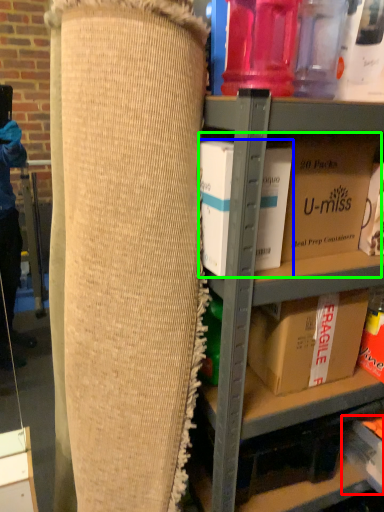
Question: Which object is the farthest from storage box (highlighted by a red box)? Choose among these: box (highlighted by a blue box) or storage box (highlighted by a green box).

Choices:
 (A) box
 (B) storage box

Answer: (A)